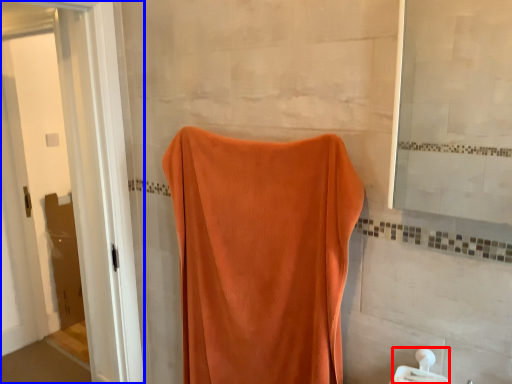
Question: Which point is further to the camera, towel bar (highlighted by a red box) or screen door (highlighted by a blue box)?

Choices:
 (A) towel bar
 (B) screen door

Answer: (B)